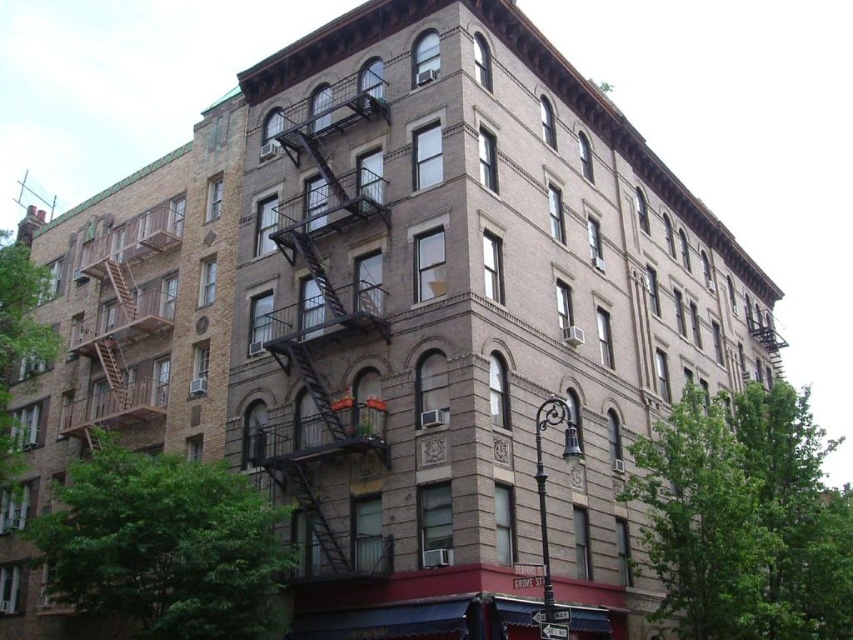
You are standing in front of the apartment building and want to reach the second floor window using either the black metal fire escape at center or the brown wooden fire escape at left. Which fire escape is positioned higher and thus closer to your target?

The black metal fire escape at center is located above the brown wooden fire escape at left, so it is positioned higher and closer to the second floor window.

Consider the image. You are standing in front of the apartment building and want to locate the black metal fire escape at center. According to the coordinates provided, where exactly is it positioned on the building?

The black metal fire escape at center is located at point coordinates 0.480 in the x and 0.383 in the y.

You are a delivery person trying to deliver a package to the apartment above the brown wooden fire escape at left. The package is too large to fit through the door. Can you use the black metal fire escape at center to access the apartment instead?

The black metal fire escape at center has a lesser width compared to brown wooden fire escape at left. Since the package is large, the narrower black metal fire escape at center might not provide enough space to maneuver the package safely. It is advisable to use the wider brown wooden fire escape at left instead.